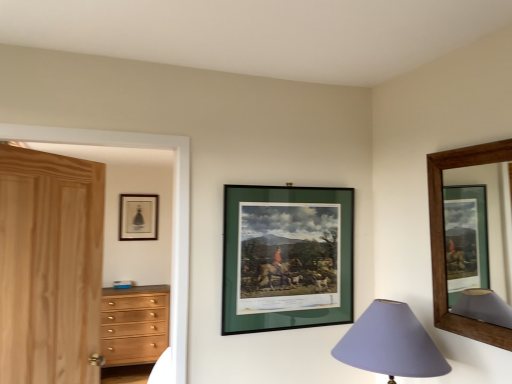
Question: Could you tell me if green matte picture frame at center, which ranks as the second picture frame in left-to-right order, is turned towards brown wooden picture frame at upper right, marked as the 1th picture frame in a right-to-left arrangement?

Choices:
 (A) no
 (B) yes

Answer: (B)

Question: Can we say green matte picture frame at center, which ranks as the second picture frame in left-to-right order, lies outside brown wooden picture frame at upper right, the third picture frame in the back-to-front sequence?

Choices:
 (A) no
 (B) yes

Answer: (B)

Question: From the image's perspective, would you say green matte picture frame at center, arranged as the 2th picture frame when viewed from the front, is positioned over brown wooden picture frame at upper right, acting as the 1th picture frame starting from the front?

Choices:
 (A) yes
 (B) no

Answer: (B)

Question: Does green matte picture frame at center, which ranks as the second picture frame in left-to-right order, appear on the left side of brown wooden picture frame at upper right, acting as the 1th picture frame starting from the front?

Choices:
 (A) no
 (B) yes

Answer: (B)

Question: Can you confirm if green matte picture frame at center, the second picture frame positioned from the right, is positioned to the right of brown wooden picture frame at upper right, acting as the 1th picture frame starting from the front?

Choices:
 (A) no
 (B) yes

Answer: (A)

Question: Is green matte picture frame at center, which ranks as the second picture frame in left-to-right order, smaller than brown wooden picture frame at upper right, the third picture frame in the back-to-front sequence?

Choices:
 (A) yes
 (B) no

Answer: (B)

Question: Can you confirm if wooden chest of drawers at left is taller than matte black frame at upper left, which is counted as the 3th picture frame, starting from the right?

Choices:
 (A) yes
 (B) no

Answer: (A)

Question: Is there a large distance between wooden chest of drawers at left and matte black frame at upper left, which is counted as the 3th picture frame, starting from the right?

Choices:
 (A) yes
 (B) no

Answer: (A)

Question: From a real-world perspective, is wooden chest of drawers at left located higher than matte black frame at upper left, which is counted as the 3th picture frame, starting from the right?

Choices:
 (A) yes
 (B) no

Answer: (B)

Question: Can you confirm if wooden chest of drawers at left is smaller than matte black frame at upper left, which is counted as the 3th picture frame, starting from the right?

Choices:
 (A) yes
 (B) no

Answer: (B)

Question: From a real-world perspective, is wooden chest of drawers at left under matte black frame at upper left, which is counted as the 3th picture frame, starting from the right?

Choices:
 (A) yes
 (B) no

Answer: (A)

Question: Can you confirm if wooden chest of drawers at left is positioned to the left of matte black frame at upper left, the third picture frame when ordered from front to back?

Choices:
 (A) no
 (B) yes

Answer: (A)

Question: Is the depth of brown wooden picture frame at upper right, marked as the 1th picture frame in a right-to-left arrangement, less than that of natural wood door at left?

Choices:
 (A) no
 (B) yes

Answer: (B)